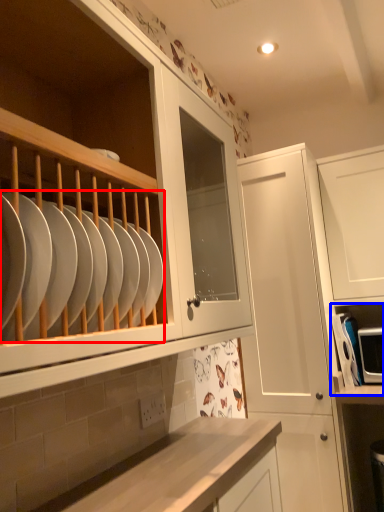
Question: Among these objects, which one is nearest to the camera, tableware (highlighted by a red box) or shelf (highlighted by a blue box)?

Choices:
 (A) tableware
 (B) shelf

Answer: (A)